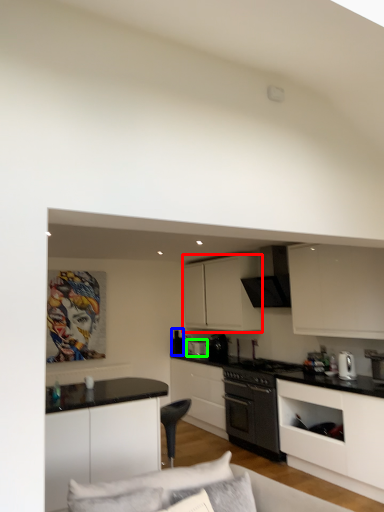
Question: Which object is positioned farthest from cabinetry (highlighted by a red box)? Select from appliance (highlighted by a blue box) and appliance (highlighted by a green box).

Choices:
 (A) appliance
 (B) appliance

Answer: (A)